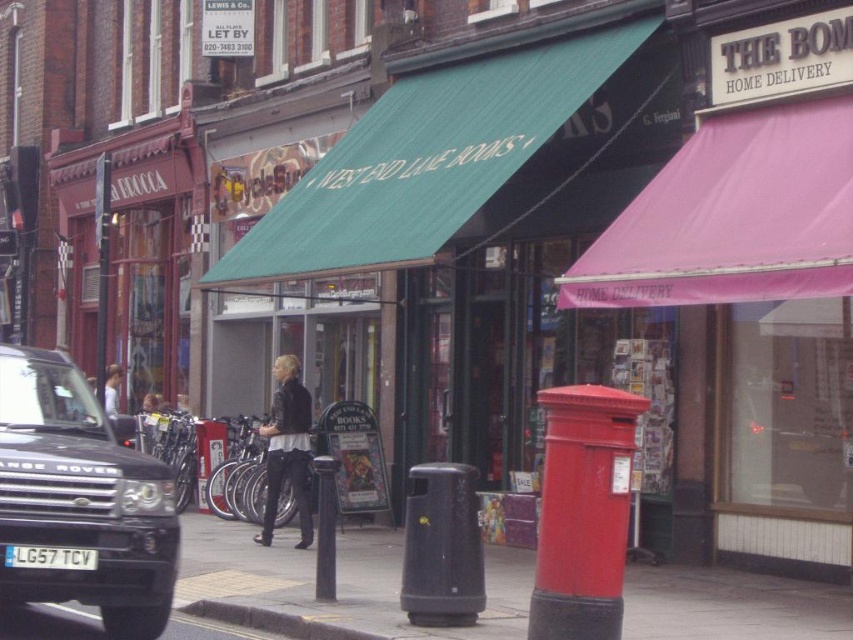
Question: Is black metallic car at left above yellow painted concrete curb at lower center?

Choices:
 (A) yes
 (B) no

Answer: (A)

Question: Which point is farther to the camera?

Choices:
 (A) black metallic car at left
 (B) white plastic license plate at lower left
 (C) black asphalt pavement at lower center
 (D) yellow painted concrete curb at lower center

Answer: (C)

Question: Which point is closer to the camera?

Choices:
 (A) (38, 557)
 (B) (770, 611)
 (C) (236, 614)

Answer: (A)

Question: Which object is farther from the camera taking this photo?

Choices:
 (A) black asphalt pavement at lower center
 (B) yellow painted concrete curb at lower center
 (C) black metallic car at left

Answer: (A)

Question: Does black asphalt pavement at lower center appear under white plastic license plate at lower left?

Choices:
 (A) yes
 (B) no

Answer: (A)

Question: Can you confirm if black asphalt pavement at lower center is positioned to the right of white plastic license plate at lower left?

Choices:
 (A) yes
 (B) no

Answer: (A)